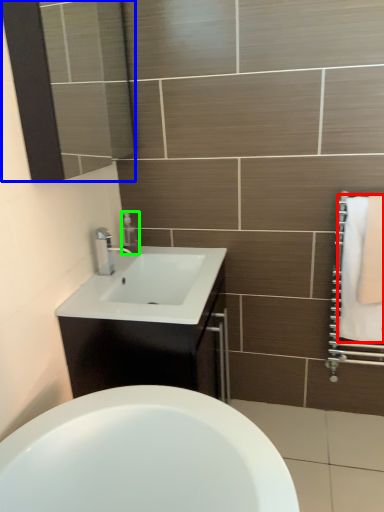
Question: Which object is positioned farthest from bath towel (highlighted by a red box)? Select from mirror (highlighted by a blue box) and soap dispenser (highlighted by a green box).

Choices:
 (A) mirror
 (B) soap dispenser

Answer: (A)